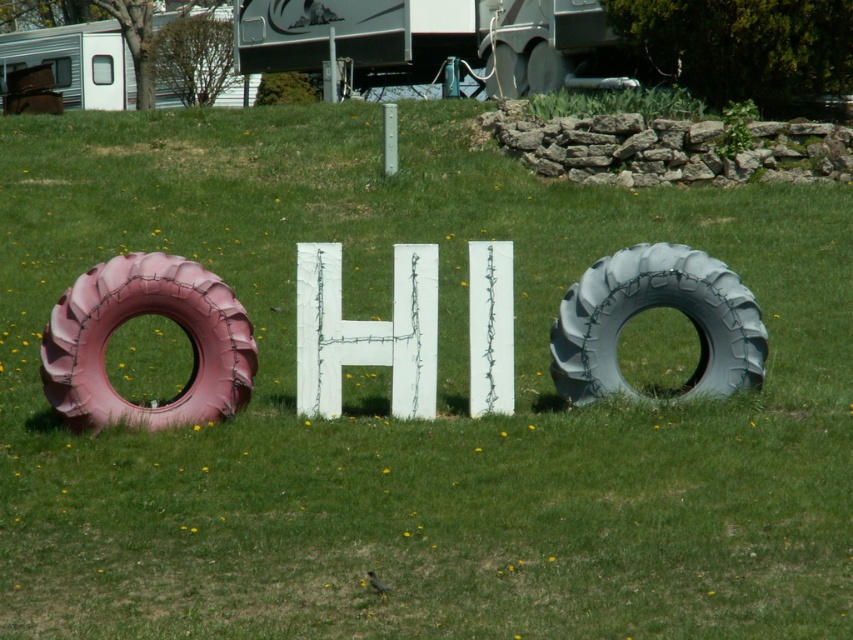
Question: Estimate the real-world distances between objects in this image. Which object is farther from the white cracked wood letter h at center?

Choices:
 (A) gray rubber tire at right
 (B) white painted wood sign at center
 (C) brushed metal trailer at upper center

Answer: (C)

Question: Can you confirm if white plastic trailer at upper left is positioned above white wood letter at center?

Choices:
 (A) no
 (B) yes

Answer: (B)

Question: Which of the following is the closest to the observer?

Choices:
 (A) (431, 330)
 (B) (67, 84)

Answer: (A)

Question: Which point is closer to the camera?

Choices:
 (A) (426, 332)
 (B) (223, 342)

Answer: (B)

Question: Does white cracked wood letter h at center appear over white painted wood sign at center?

Choices:
 (A) yes
 (B) no

Answer: (B)

Question: Can you confirm if pink rubber tire at left is bigger than white plastic trailer at upper left?

Choices:
 (A) no
 (B) yes

Answer: (A)